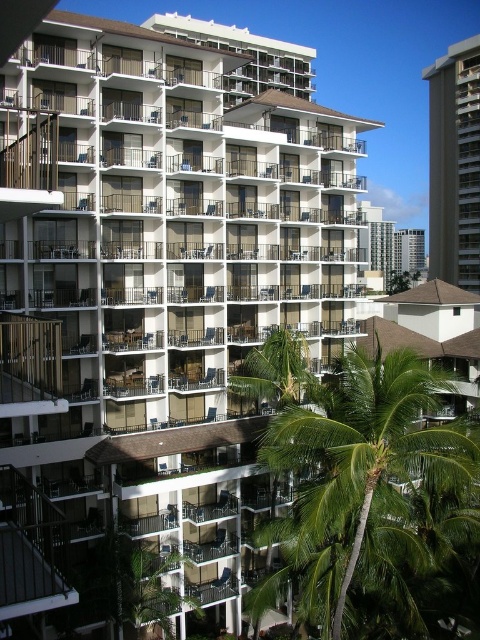
You are standing on the sidewalk in front of the smooth concrete building at right and the green leafy palm tree at center. Which object is higher up in the scene?

The smooth concrete building at right is located above the green leafy palm tree at center, so it is higher up in the scene.

You are a drone operator who needs to fly a drone from the green leafy palm tree at lower right to the smooth concrete building at right. Given that the drone has a maximum flight range of 100 meters, will it be able to reach the building without needing to recharge?

The green leafy palm tree at lower right is 95.24 meters away from the smooth concrete building at right. Since the drone has a maximum flight range of 100 meters, it can reach the building without needing to recharge because 95.24 meters is within the 100 meters limit.

You are standing at the base of the residential building and looking towards the building. There are two points marked on the building facade. The first is at point [403,522] and the second is at point [465,248]. Which of these two points is closer to you?

Point [403,522] is in front of point [465,248], so it is closer to you.